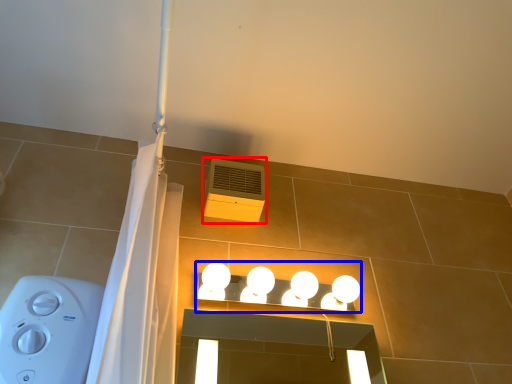
Question: Which of the following is the closest to the observer, air conditioning (highlighted by a red box) or lamp (highlighted by a blue box)?

Choices:
 (A) air conditioning
 (B) lamp

Answer: (B)